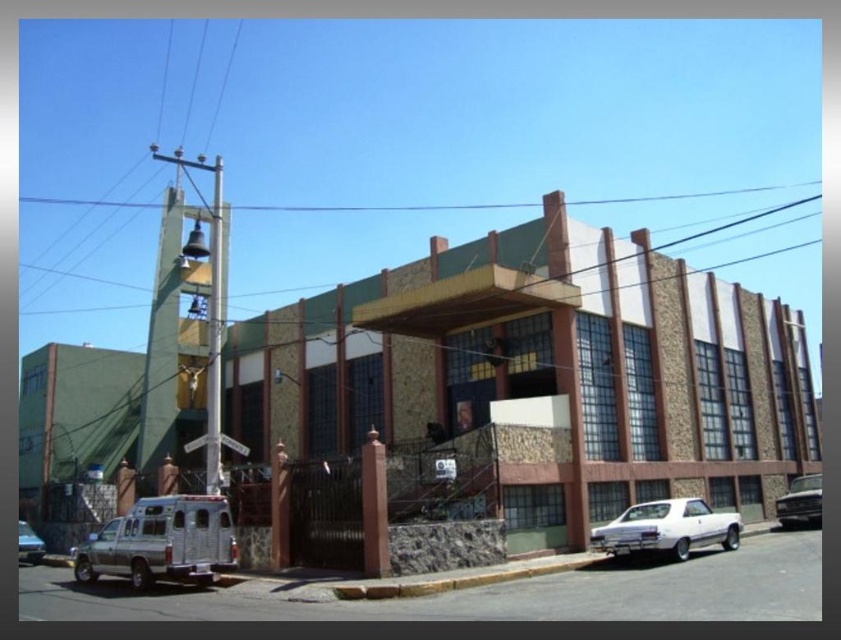
Question: Based on their relative distances, which object is nearer to the silver metallic van at lower left?

Choices:
 (A) metallic silver truck at lower right
 (B) white matte sedan at lower right

Answer: (B)

Question: Which object appears closest to the camera in this image?

Choices:
 (A) white matte sedan at lower right
 (B) metallic silver truck at lower right
 (C) silver metallic van at lower left

Answer: (A)

Question: Is white matte sedan at lower right positioned behind metallic silver truck at lower right?

Choices:
 (A) no
 (B) yes

Answer: (A)

Question: Which of the following is the closest to the observer?

Choices:
 (A) (648, 509)
 (B) (22, 528)

Answer: (A)

Question: Observing the image, what is the correct spatial positioning of white matte sedan at lower right in reference to metallic silver truck at lower right?

Choices:
 (A) left
 (B) right

Answer: (A)

Question: Can you confirm if white matte sedan at lower right is wider than metallic silver truck at lower right?

Choices:
 (A) no
 (B) yes

Answer: (B)